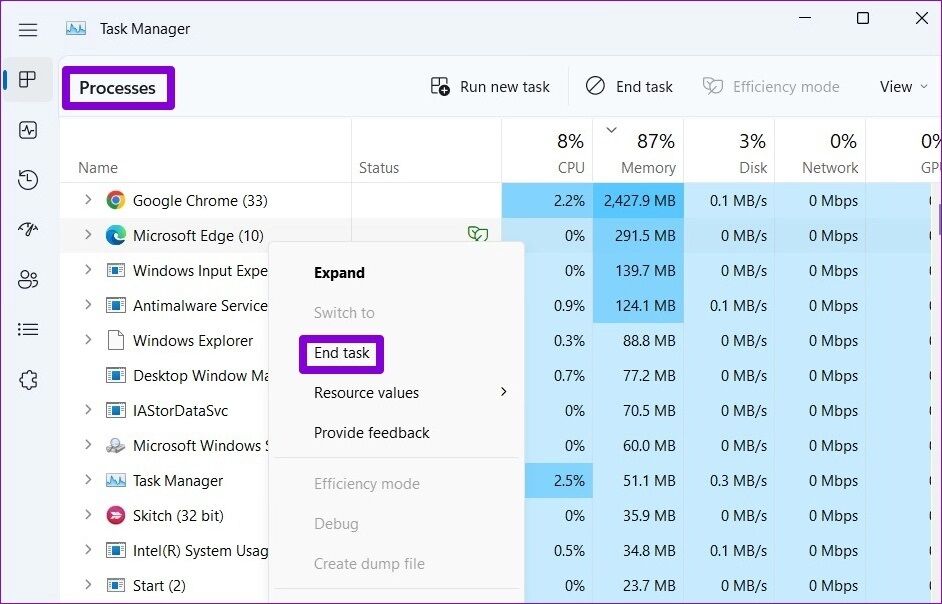
Find the location of a particular element. columns is located at coordinates (229, 579), (465, 547), (534, 598), (604, 588), (697, 588), (793, 580), (906, 590).